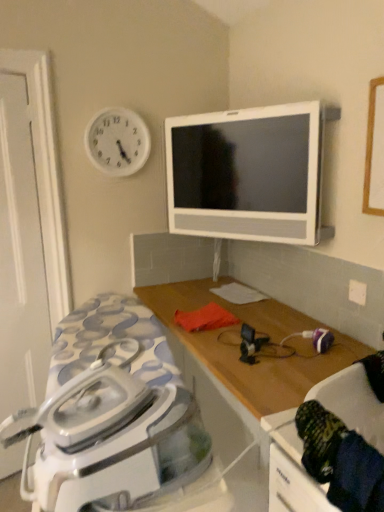
Question: Is white glossy iron at lower left positioned beyond the bounds of dark blue fabric swivel chair at lower right?

Choices:
 (A) no
 (B) yes

Answer: (B)

Question: Is white glossy iron at lower left turned away from dark blue fabric swivel chair at lower right?

Choices:
 (A) yes
 (B) no

Answer: (B)

Question: From a real-world perspective, does white glossy iron at lower left stand above dark blue fabric swivel chair at lower right?

Choices:
 (A) no
 (B) yes

Answer: (A)

Question: Can you confirm if white glossy iron at lower left is thinner than dark blue fabric swivel chair at lower right?

Choices:
 (A) no
 (B) yes

Answer: (A)

Question: From the image's perspective, is white glossy iron at lower left under dark blue fabric swivel chair at lower right?

Choices:
 (A) yes
 (B) no

Answer: (A)

Question: From a real-world perspective, is white glossy iron at lower left located beneath dark blue fabric swivel chair at lower right?

Choices:
 (A) no
 (B) yes

Answer: (B)

Question: Would you consider white matte door at left to be distant from white plastic clock at upper left?

Choices:
 (A) no
 (B) yes

Answer: (A)

Question: Considering the relative sizes of white matte door at left and white plastic clock at upper left in the image provided, is white matte door at left wider than white plastic clock at upper left?

Choices:
 (A) no
 (B) yes

Answer: (B)

Question: Does white matte door at left appear on the left side of white plastic clock at upper left?

Choices:
 (A) yes
 (B) no

Answer: (A)

Question: Is white plastic clock at upper left completely or partially inside white matte door at left?

Choices:
 (A) no
 (B) yes

Answer: (A)

Question: Can you confirm if white matte door at left is smaller than white plastic clock at upper left?

Choices:
 (A) no
 (B) yes

Answer: (A)

Question: Does white matte door at left have a larger size compared to white plastic clock at upper left?

Choices:
 (A) yes
 (B) no

Answer: (A)

Question: Is white glossy iron at lower left looking in the opposite direction of white matte door at left?

Choices:
 (A) yes
 (B) no

Answer: (B)